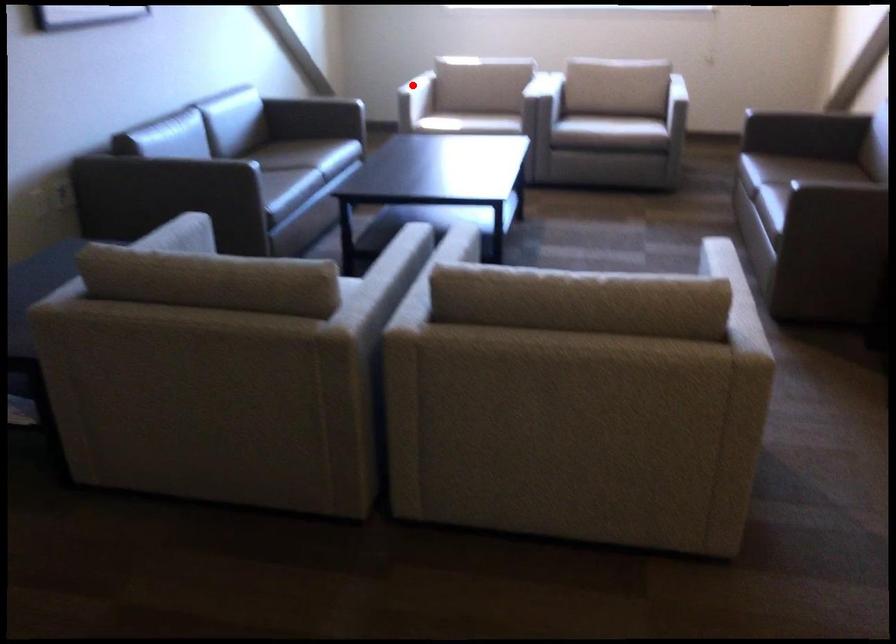
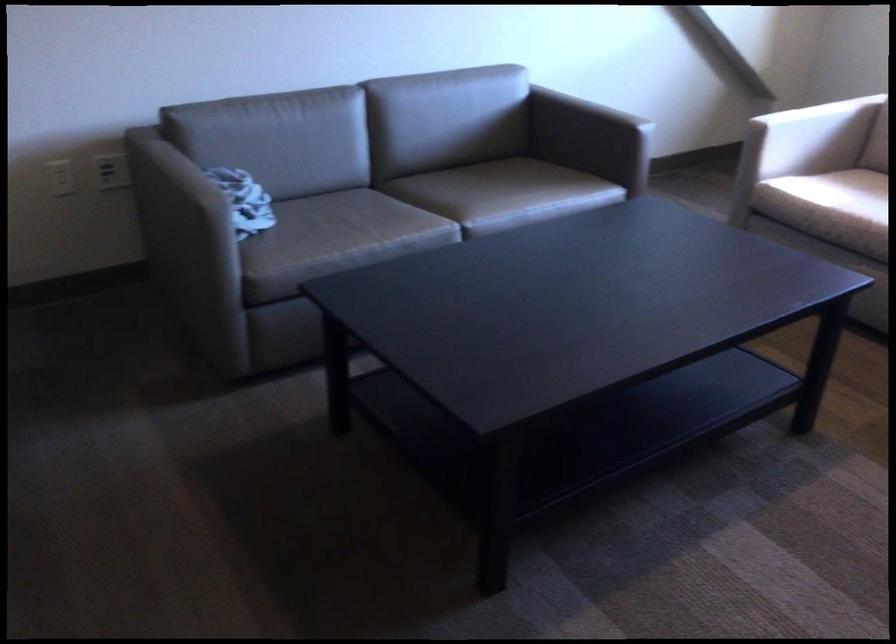
Question: I am providing you with two images of the same scene from different viewpoints. A red point is marked on the first image. Is the red point's position out of view in image 2?

Choices:
 (A) Yes
 (B) No

Answer: (B)